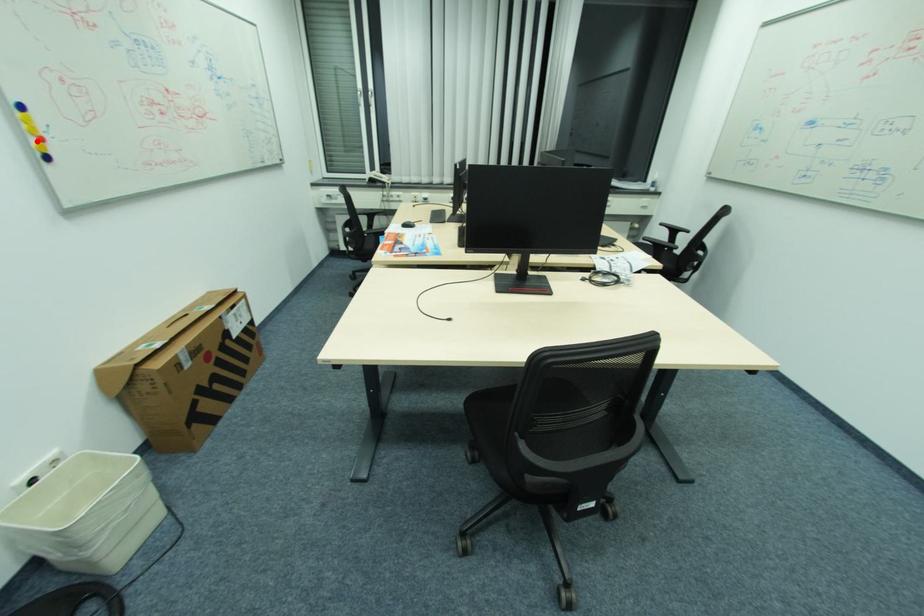
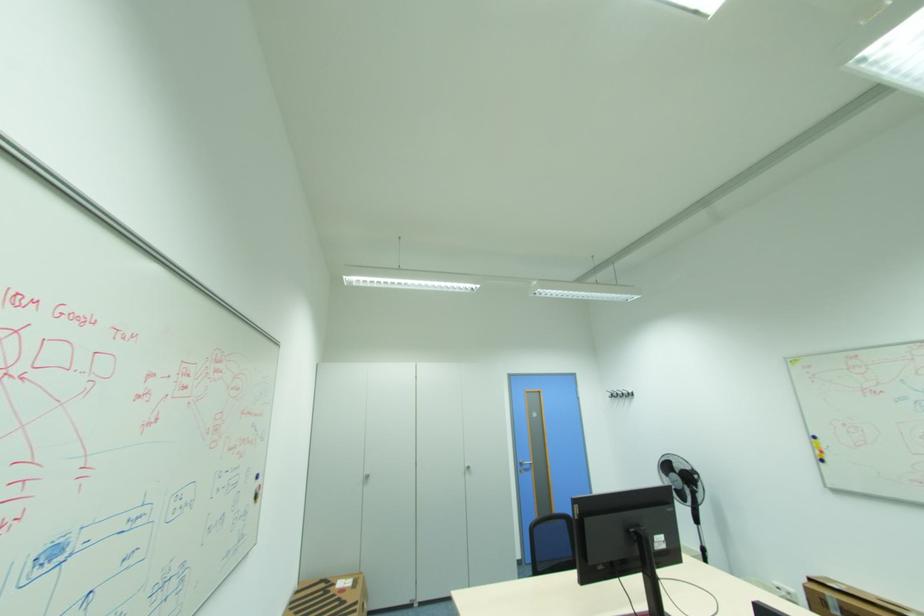
Question: A red point is marked in image1. In image2, is the corresponding 3D point closer to the camera or farther? Reply with the corresponding letter.

Choices:
 (A) The corresponding 3D point is closer.
 (B) The corresponding 3D point is farther.

Answer: (A)